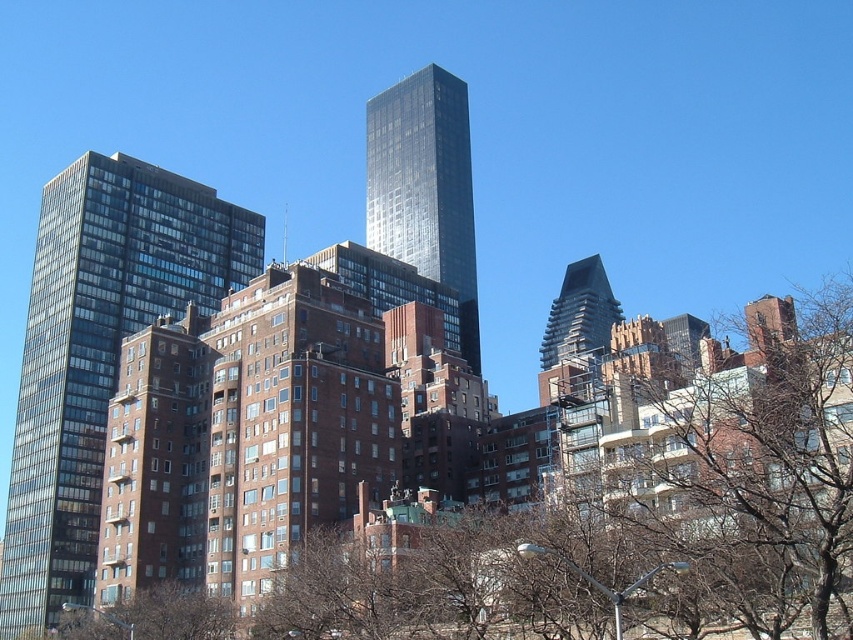
Question: From the image, what is the correct spatial relationship of glassy reflective building at left in relation to shiny glass skyscraper at center?

Choices:
 (A) above
 (B) below

Answer: (B)

Question: Is brown leafless tree at center below glassy reflective building at left?

Choices:
 (A) no
 (B) yes

Answer: (B)

Question: Which of the following is the farthest from the observer?

Choices:
 (A) (463, 301)
 (B) (136, 486)

Answer: (A)

Question: Which point is farther from the camera taking this photo?

Choices:
 (A) [418, 108]
 (B) [204, 413]

Answer: (A)

Question: Does brown leafless tree at center appear under glassy reflective building at left?

Choices:
 (A) no
 (B) yes

Answer: (B)

Question: Which point appears closest to the camera in this image?

Choices:
 (A) (392, 618)
 (B) (247, 259)

Answer: (A)